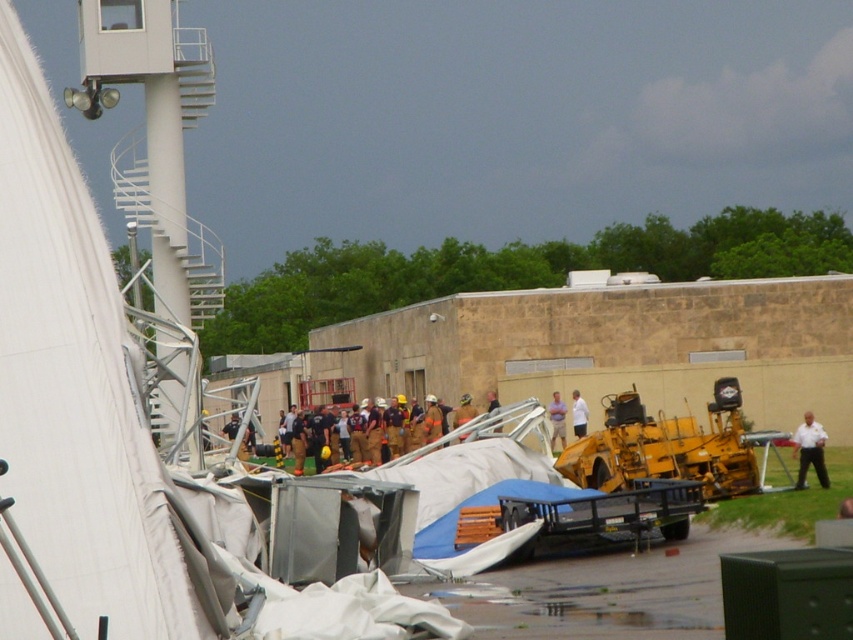
Can you confirm if light blue shirt at center is smaller than white fabric at center?

Correct, light blue shirt at center occupies less space than white fabric at center.

Between light blue shirt at center and white fabric at center, which one appears on the right side from the viewer's perspective?

Positioned to the right is white fabric at center.

Does point (552, 433) come farther from viewer compared to point (573, 417)?

Yes, point (552, 433) is behind point (573, 417).

Find the location of `light blue shirt at center`. light blue shirt at center is located at coordinates tap(556, 419).

Who is positioned more to the right, white uniform at right or white fabric at center?

white uniform at right

Based on the photo, does white uniform at right have a greater height compared to white fabric at center?

No, white uniform at right is not taller than white fabric at center.

Is point (802, 484) less distant than point (573, 403)?

That is True.

Image resolution: width=853 pixels, height=640 pixels. I want to click on white uniform at right, so click(x=810, y=451).

Does white fabric at center appear over light brown leather jacket at center?

No, white fabric at center is not above light brown leather jacket at center.

Looking at this image, can you confirm if white fabric at center is thinner than light brown leather jacket at center?

Correct, white fabric at center's width is less than light brown leather jacket at center's.

Who is more distant from viewer, (573,403) or (494,392)?

The point (494,392) is behind.

This screenshot has height=640, width=853. Find the location of `white fabric at center`. white fabric at center is located at coordinates click(x=578, y=413).